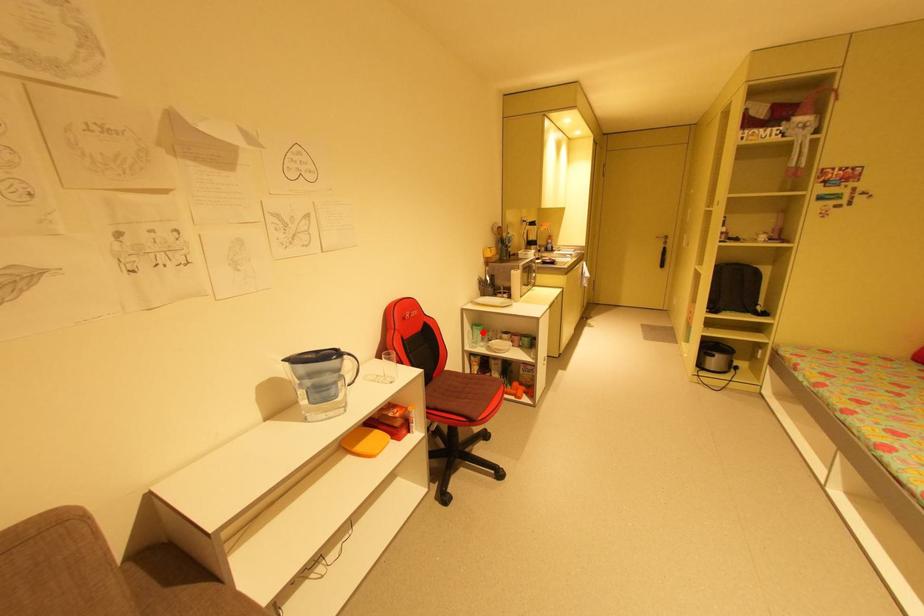
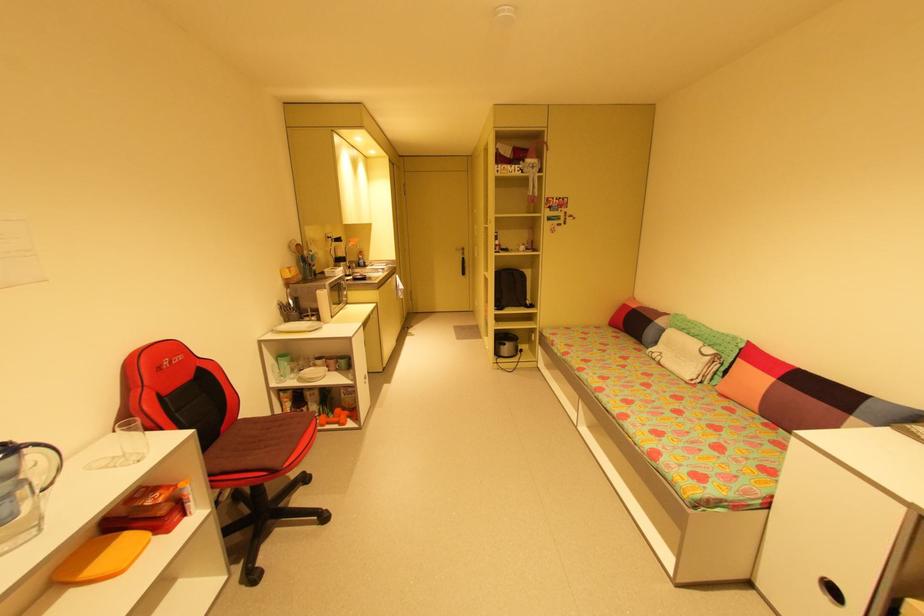
Question: I am providing you with two images of the same scene from different viewpoints. A red point is marked on the first image. Can you still see the location of the red point in image 2?

Choices:
 (A) Yes
 (B) No

Answer: (A)